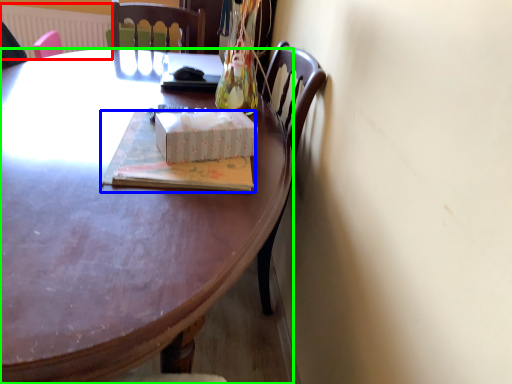
Question: Which is nearer to the radiator (highlighted by a red box)? book (highlighted by a blue box) or desk (highlighted by a green box).

Choices:
 (A) book
 (B) desk

Answer: (B)